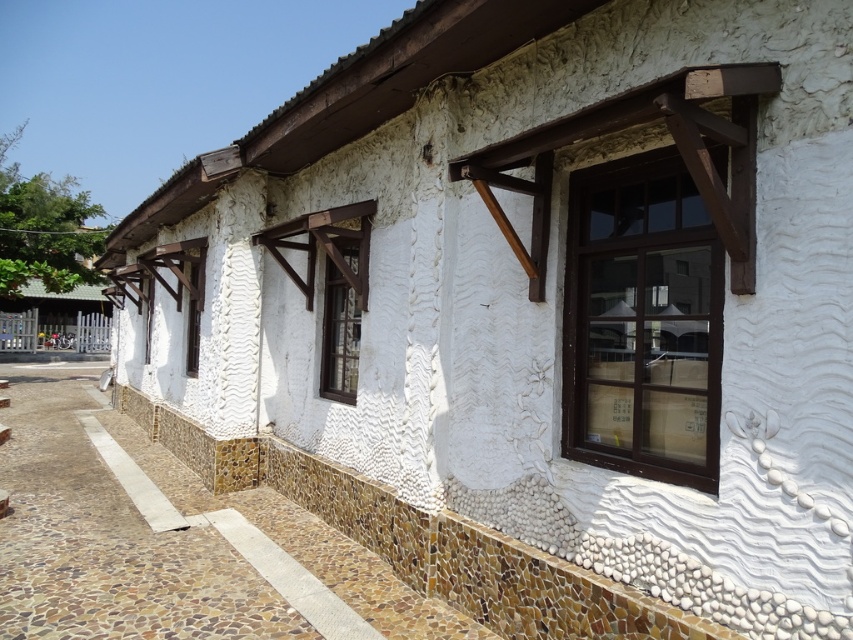
Can you confirm if matte glass window at center is smaller than white textured window at center?

Yes, matte glass window at center is smaller than white textured window at center.

What do you see at coordinates (339, 336) in the screenshot? This screenshot has height=640, width=853. I see `matte glass window at center` at bounding box center [339, 336].

Find the location of `matte glass window at center`. matte glass window at center is located at coordinates (339, 336).

Can you confirm if brown wooden window at center is taller than matte white window at center?

Correct, brown wooden window at center is much taller as matte white window at center.

Does brown wooden window at center have a lesser height compared to matte white window at center?

No.

Which is behind, point (688, 464) or point (201, 248)?

Point (201, 248)

The height and width of the screenshot is (640, 853). I want to click on brown wooden window at center, so click(x=642, y=321).

How far apart are brown wooden window at center and matte glass window at center?

A distance of 3.73 meters exists between brown wooden window at center and matte glass window at center.

Between brown wooden window at center and matte glass window at center, which one has more height?

brown wooden window at center

Between point (608, 412) and point (331, 268), which one is positioned in front?

Positioned in front is point (608, 412).

I want to click on brown wooden window at center, so click(642, 321).